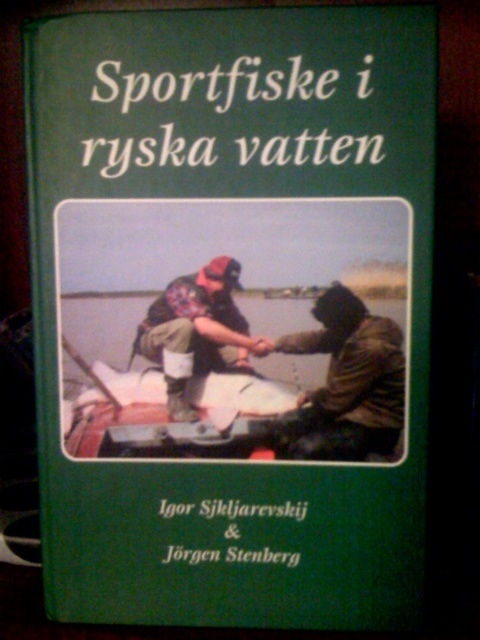
Question: Considering the relative positions of dark green hooded jacket at center and camouflage fabric shirt at center in the image provided, where is dark green hooded jacket at center located with respect to camouflage fabric shirt at center?

Choices:
 (A) above
 (B) below

Answer: (B)

Question: Is dark green hooded jacket at center further to camera compared to camouflage fabric shirt at center?

Choices:
 (A) no
 (B) yes

Answer: (A)

Question: Is dark green hooded jacket at center to the right of camouflage fabric shirt at center from the viewer's perspective?

Choices:
 (A) yes
 (B) no

Answer: (A)

Question: Among these objects, which one is nearest to the camera?

Choices:
 (A) dark green hooded jacket at center
 (B) camouflage fabric shirt at center

Answer: (A)

Question: Which of the following is the farthest from the observer?

Choices:
 (A) dark green hooded jacket at center
 (B) camouflage fabric shirt at center

Answer: (B)

Question: Which of the following is the farthest from the observer?

Choices:
 (A) (304, 426)
 (B) (177, 413)

Answer: (B)